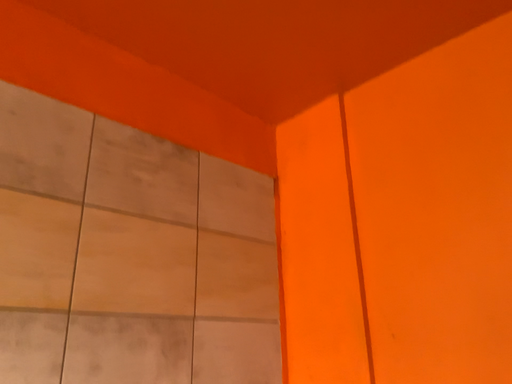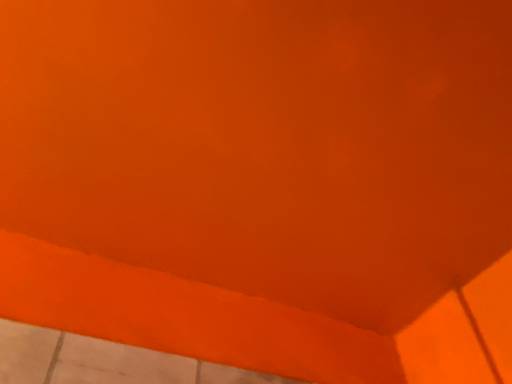
Question: Which way did the camera rotate in the video?

Choices:
 (A) rotated right
 (B) rotated left

Answer: (B)